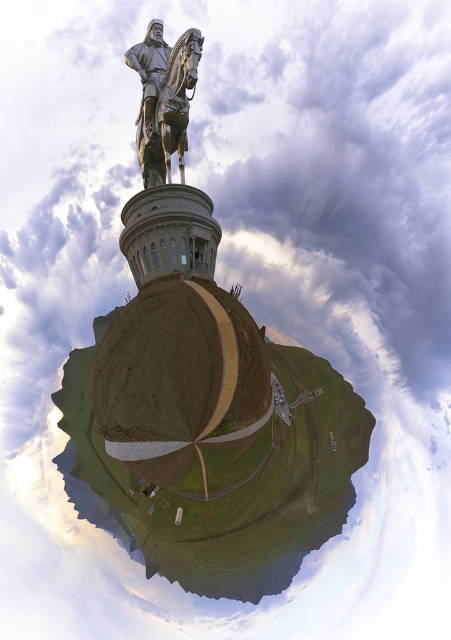
You are standing at the base of the large statue and want to walk directly towards the brown grassy hill at center. According to the image, what coordinate point should you aim for?

The brown grassy hill at center is located at coordinate point (211, 440), so you should aim for that point.

Looking at this image, you are standing at the base of the statue and want to walk towards the brown grassy hill at center. Which direction should you move relative to the bronze statue at upper center?

You should move towards the brown grassy hill at center, which is located in front of the bronze statue at upper center, so you would walk forward away from the statue towards the hill.